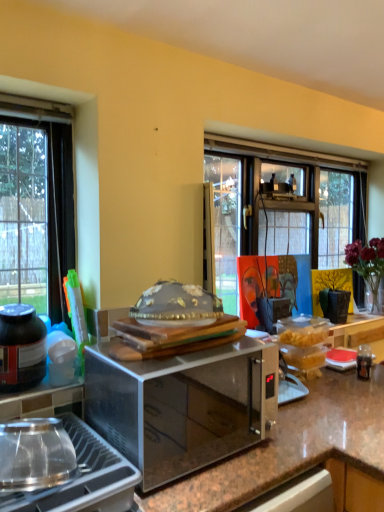
The image size is (384, 512). What do you see at coordinates (21, 346) in the screenshot?
I see `black matte jar at lower left` at bounding box center [21, 346].

Locate an element on the screen. This screenshot has width=384, height=512. orange canvas painting at center is located at coordinates (266, 288).

Describe the element at coordinates (266, 288) in the screenshot. I see `orange canvas painting at center` at that location.

I want to click on black matte jar at lower left, so [x=21, y=346].

Considering the sizes of satin metallic microwave at center and brown granite countertop at center in the image, is satin metallic microwave at center taller or shorter than brown granite countertop at center?

In the image, satin metallic microwave at center appears to be shorter than brown granite countertop at center.

From the image's perspective, would you say satin metallic microwave at center is positioned over brown granite countertop at center?

Indeed, from the image's perspective, satin metallic microwave at center is shown above brown granite countertop at center.

From a real-world perspective, is satin metallic microwave at center above or below brown granite countertop at center?

Clearly, from a real-world perspective, satin metallic microwave at center is above brown granite countertop at center.

Who is taller, translucent glass vase at upper right or stainless steel gas stove at lower left?

With more height is translucent glass vase at upper right.

Considering the sizes of objects translucent glass vase at upper right and stainless steel gas stove at lower left in the image provided, who is thinner, translucent glass vase at upper right or stainless steel gas stove at lower left?

translucent glass vase at upper right.

Locate an element on the screen. The width and height of the screenshot is (384, 512). flower located above the stainless steel gas stove at lower left (from the image's perspective) is located at coordinates (367, 260).

Considering the relative sizes of brown granite countertop at center and orange canvas painting at center in the image provided, is brown granite countertop at center smaller than orange canvas painting at center?

Incorrect, brown granite countertop at center is not smaller in size than orange canvas painting at center.

Is orange canvas painting at center at the back of brown granite countertop at center?

brown granite countertop at center is not turned away from orange canvas painting at center.

In the image, is brown granite countertop at center positioned in front of or behind orange canvas painting at center?

brown granite countertop at center is in front of orange canvas painting at center.

Is brown granite countertop at center far from orange canvas painting at center?

No.

From a real-world perspective, is brown granite countertop at center physically below satin metallic microwave at center?

Indeed, from a real-world perspective, brown granite countertop at center is positioned beneath satin metallic microwave at center.

Are brown granite countertop at center and satin metallic microwave at center beside each other?

No, brown granite countertop at center is not touching satin metallic microwave at center.

Who is bigger, brown granite countertop at center or satin metallic microwave at center?

Bigger between the two is brown granite countertop at center.

Is brown granite countertop at center oriented towards satin metallic microwave at center?

Yes, brown granite countertop at center is turned towards satin metallic microwave at center.

Identify the location of flower above the orange canvas painting at center (from the image's perspective). (367, 260).

Is orange canvas painting at center in front of translucent glass vase at upper right?

Yes, orange canvas painting at center is closer to the viewer.

Does orange canvas painting at center have a smaller size compared to translucent glass vase at upper right?

Correct, orange canvas painting at center occupies less space than translucent glass vase at upper right.

Between black matte jar at lower left and brown granite countertop at center, which one is positioned behind?

Positioned behind is black matte jar at lower left.

Looking at this image, which of these two, black matte jar at lower left or brown granite countertop at center, is smaller?

black matte jar at lower left is smaller.

Is black matte jar at lower left positioned far away from brown granite countertop at center?

black matte jar at lower left is actually quite close to brown granite countertop at center.

Is black matte jar at lower left not inside stainless steel gas stove at lower left?

black matte jar at lower left is positioned outside stainless steel gas stove at lower left.

Is black matte jar at lower left positioned far away from stainless steel gas stove at lower left?

black matte jar at lower left is actually quite close to stainless steel gas stove at lower left.

What's the angular difference between black matte jar at lower left and stainless steel gas stove at lower left's facing directions?

There is a 2.95-degree angle between the facing directions of black matte jar at lower left and stainless steel gas stove at lower left.

Which is less distant, (x=11, y=358) or (x=121, y=498)?

Point (x=11, y=358).

Where is `countertop on the right of the satin metallic microwave at center`? The width and height of the screenshot is (384, 512). countertop on the right of the satin metallic microwave at center is located at coordinates (292, 446).

Locate an element on the screen. The height and width of the screenshot is (512, 384). flower lying behind the stainless steel gas stove at lower left is located at coordinates (367, 260).

Considering their positions, is orange canvas painting at center positioned further to brown granite countertop at center than black matte jar at lower left?

black matte jar at lower left.

Which object lies further to the anchor point black matte jar at lower left, orange canvas painting at center or satin metallic microwave at center?

orange canvas painting at center.

From the image, which object appears to be farther from orange canvas painting at center, translucent glass vase at upper right or satin metallic microwave at center?

translucent glass vase at upper right.

Based on their spatial positions, is satin metallic microwave at center or translucent glass vase at upper right further from brown granite countertop at center?

The object further to brown granite countertop at center is translucent glass vase at upper right.

Looking at the image, which one is located further to brown granite countertop at center, stainless steel gas stove at lower left or translucent glass vase at upper right?

translucent glass vase at upper right is positioned further to the anchor brown granite countertop at center.

Looking at the image, which one is located further to translucent glass vase at upper right, orange canvas painting at center or stainless steel gas stove at lower left?

Among the two, stainless steel gas stove at lower left is located further to translucent glass vase at upper right.

Which object lies nearer to the anchor point stainless steel gas stove at lower left, translucent glass vase at upper right or black matte jar at lower left?

black matte jar at lower left is closer to stainless steel gas stove at lower left.

From the image, which object appears to be nearer to satin metallic microwave at center, brown granite countertop at center or translucent glass vase at upper right?

brown granite countertop at center.

Find the location of a particular element. microwave oven between stainless steel gas stove at lower left and translucent glass vase at upper right along the z-axis is located at coordinates (181, 406).

The image size is (384, 512). Identify the location of bottle between satin metallic microwave at center and orange canvas painting at center in the front-back direction. (21, 346).

Locate an element on the screen. This screenshot has width=384, height=512. countertop between black matte jar at lower left and translucent glass vase at upper right from left to right is located at coordinates (292, 446).

Where is `gas stove between black matte jar at lower left and translucent glass vase at upper right in the horizontal direction`? The image size is (384, 512). gas stove between black matte jar at lower left and translucent glass vase at upper right in the horizontal direction is located at coordinates (83, 478).